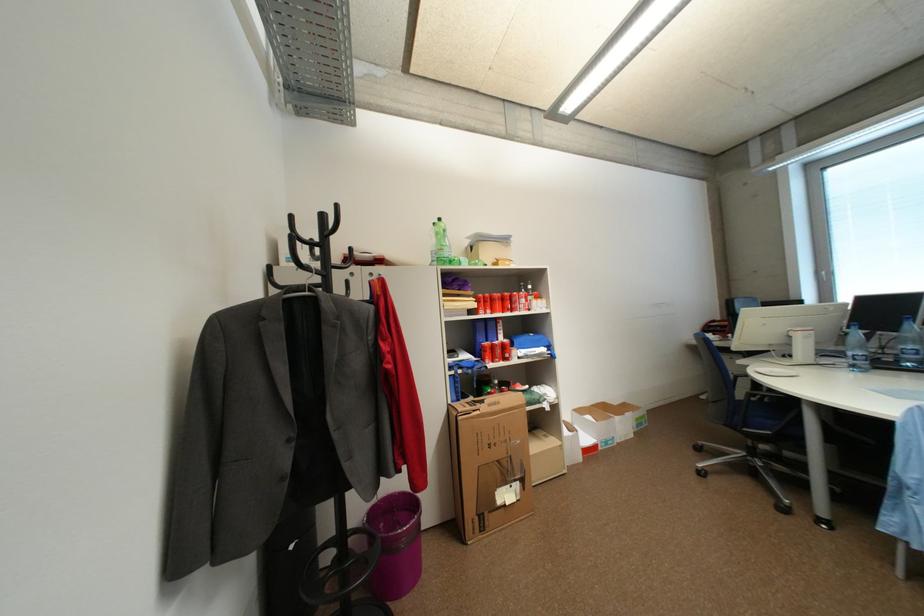
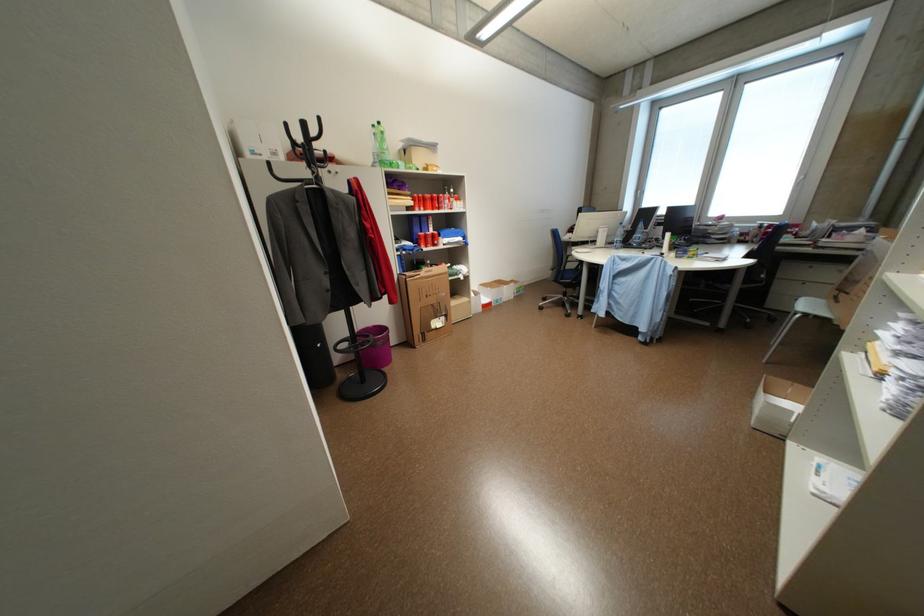
Locate, in the second image, the point that corresponds to point 487,416 in the first image.

(428, 280)